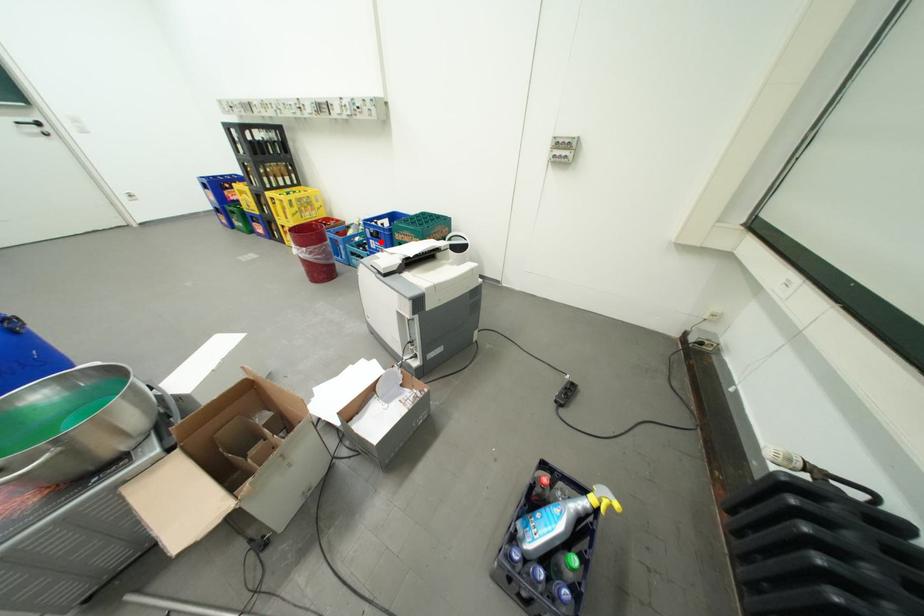
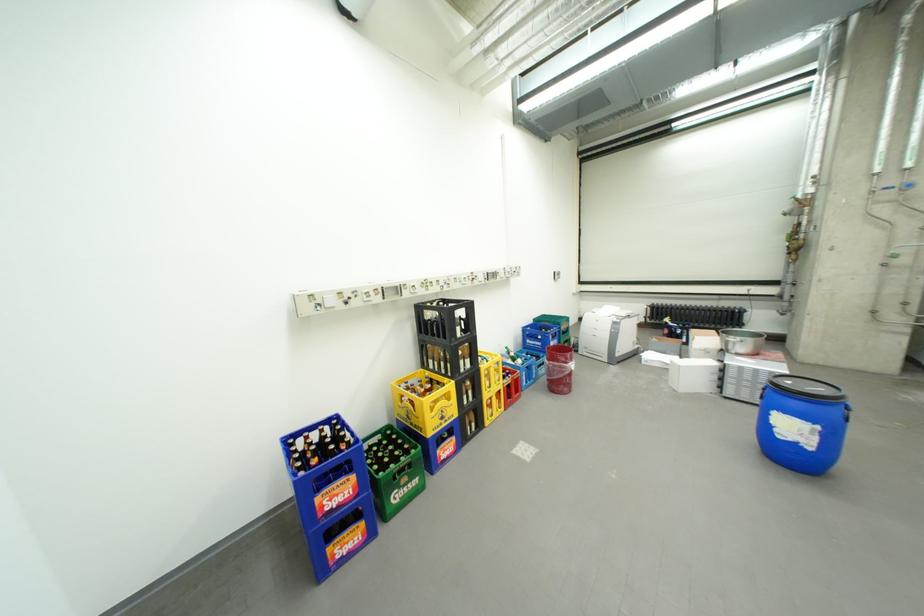
Question: I am providing you with two images of the same scene from different viewpoints. Image1 has a red point marked. In image2, the corresponding 3D location appears at what relative position? Reply with the corresponding letter.

Choices:
 (A) Closer
 (B) Farther

Answer: (A)